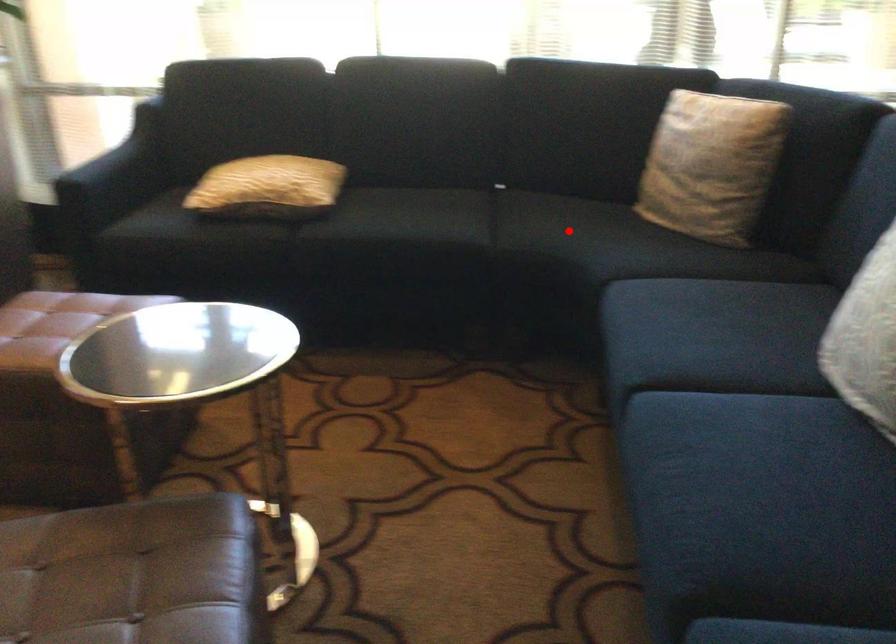
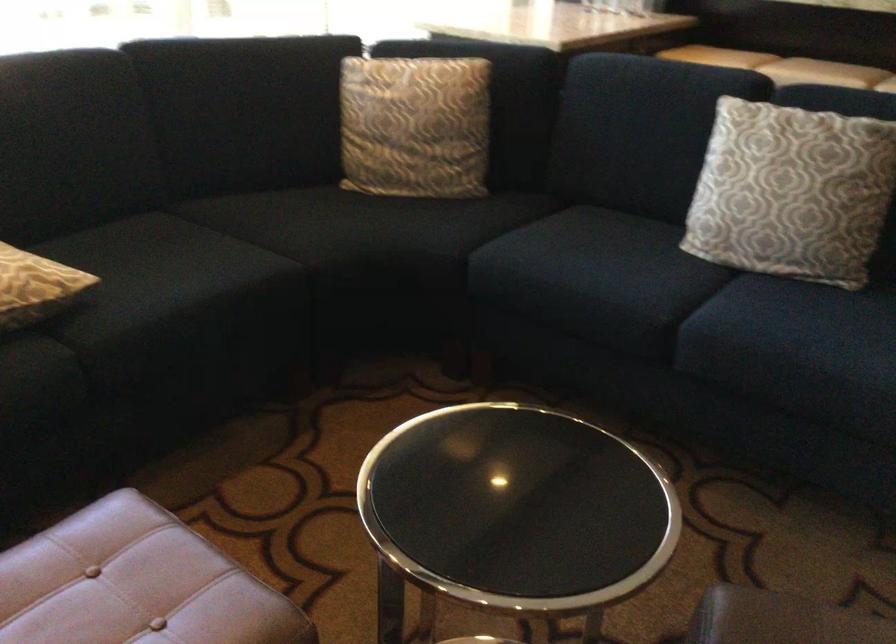
Question: A red point is marked in image1. In image2, is the corresponding 3D point closer to the camera or farther? Reply with the corresponding letter.

Choices:
 (A) The corresponding 3D point is closer.
 (B) The corresponding 3D point is farther.

Answer: (A)